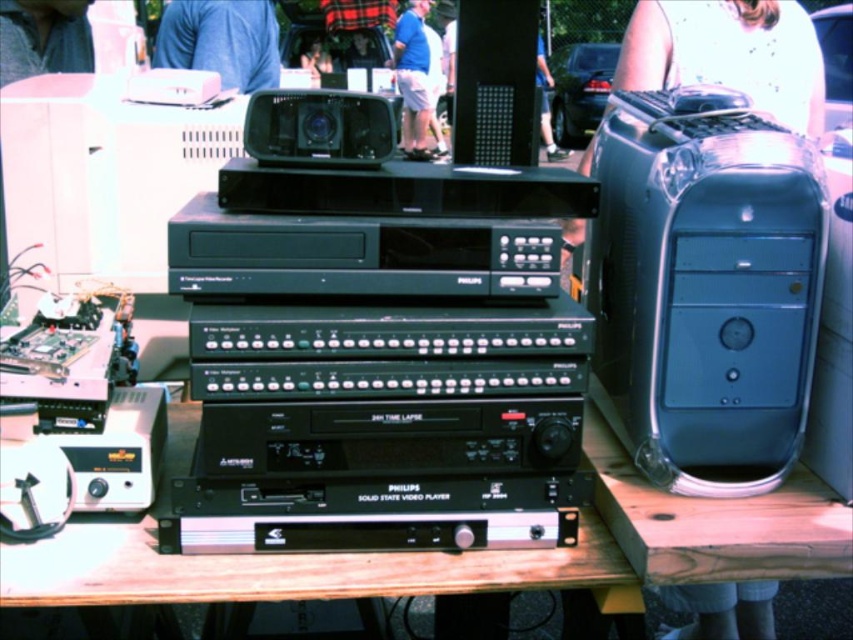
Question: Among these points, which one is nearest to the camera?

Choices:
 (A) (334, 148)
 (B) (467, 131)
 (C) (773, 449)

Answer: (A)

Question: Can you confirm if satin silver computer tower at right is thinner than black plastic radio at center?

Choices:
 (A) no
 (B) yes

Answer: (A)

Question: Which point is closer to the camera?

Choices:
 (A) satin silver computer tower at right
 (B) black matte speaker at upper center
 (C) black plastic radio at center

Answer: (A)

Question: Observing the image, what is the correct spatial positioning of satin silver computer tower at right in reference to black plastic radio at center?

Choices:
 (A) below
 (B) above

Answer: (A)

Question: Which point is closer to the camera taking this photo?

Choices:
 (A) (637, 298)
 (B) (381, 120)
 (C) (462, 156)

Answer: (B)

Question: Is satin silver computer tower at right below black matte speaker at upper center?

Choices:
 (A) no
 (B) yes

Answer: (B)